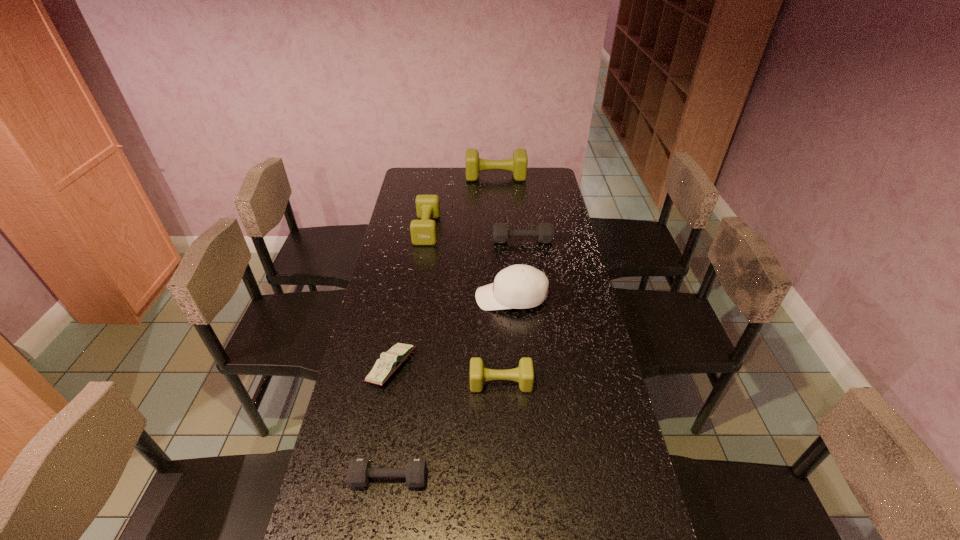
The height and width of the screenshot is (540, 960). I want to click on blank area located 0.170m on the back of the second nearest dumbbell, so click(x=498, y=330).

Where is `free space located 0.110m on the right of the smaller gray dumbbell`? free space located 0.110m on the right of the smaller gray dumbbell is located at coordinates (471, 478).

Identify the location of vacant space situated on the front of the shortest object. Image resolution: width=960 pixels, height=540 pixels. (377, 444).

I want to click on object that is at the far edge, so click(x=518, y=164).

The width and height of the screenshot is (960, 540). I want to click on diary that is positioned at the left edge, so click(x=388, y=363).

The image size is (960, 540). Find the location of `baseball cap situated at the right edge`. baseball cap situated at the right edge is located at coordinates (519, 286).

The width and height of the screenshot is (960, 540). In order to click on object present at the far right corner in this screenshot , I will do `click(518, 164)`.

The height and width of the screenshot is (540, 960). I want to click on free location at the far edge, so click(484, 190).

Where is `free location at the left edge`? free location at the left edge is located at coordinates (429, 194).

At what (x,y) coordinates should I click in order to perform the action: click on vacant area at the right edge of the desktop. Please return your answer as a coordinate pair (x, y). Image resolution: width=960 pixels, height=540 pixels. Looking at the image, I should click on (547, 207).